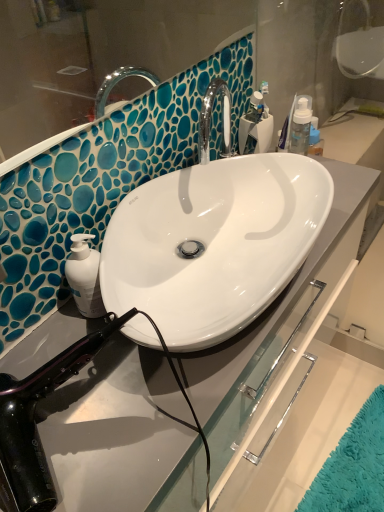
Where is `free area below black glossy hair dryer at lower left (from a real-world perspective)`? free area below black glossy hair dryer at lower left (from a real-world perspective) is located at coordinates click(71, 406).